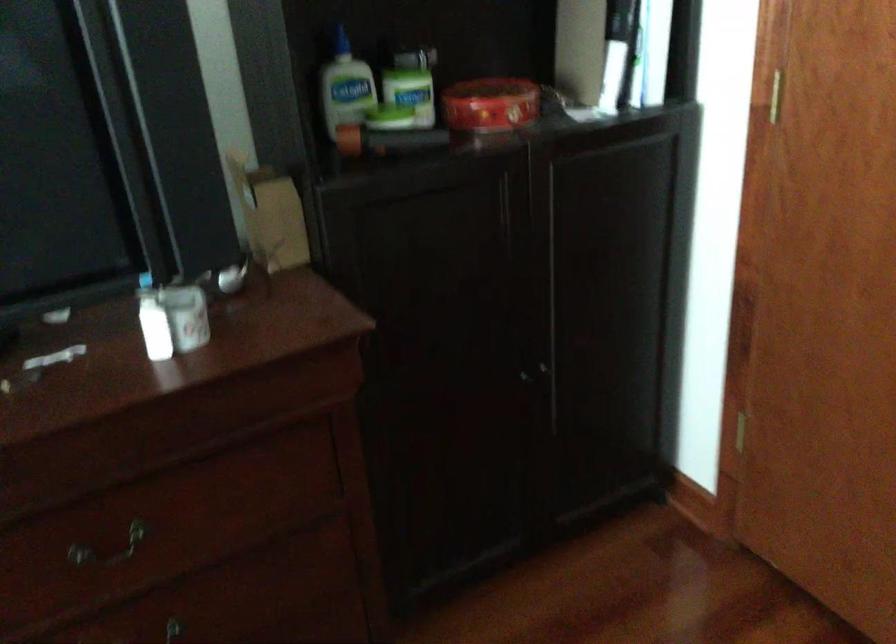
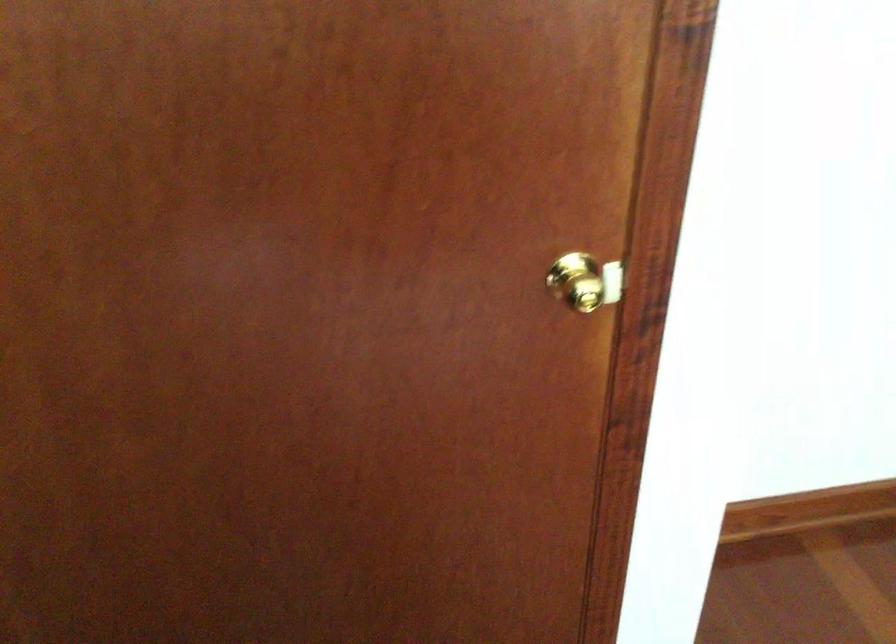
Question: Based on the continuous images, in which direction is the camera rotating? Reply with the corresponding letter.

Choices:
 (A) Left
 (B) Right
 (C) Up
 (D) Down

Answer: (B)